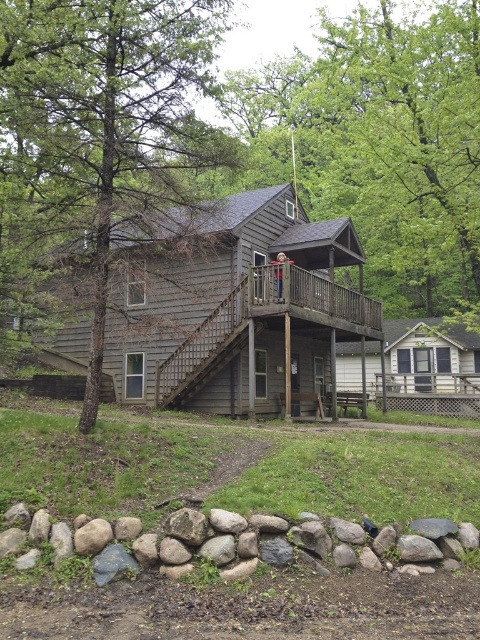
Can you confirm if brown textured tree at left is wider than gray rock wall at lower center?

No.

Is brown textured tree at left to the left of gray rock wall at lower center from the viewer's perspective?

Yes, brown textured tree at left is to the left of gray rock wall at lower center.

This screenshot has height=640, width=480. In order to click on brown textured tree at left in this screenshot , I will do `click(106, 122)`.

Is smooth rock wall at lower center taller than wooden porch at center?

In fact, smooth rock wall at lower center may be shorter than wooden porch at center.

Does smooth rock wall at lower center have a smaller size compared to wooden porch at center?

Yes, smooth rock wall at lower center is smaller than wooden porch at center.

Is point (455, 516) less distant than point (418, 385)?

That is True.

Identify the location of smooth rock wall at lower center. (229, 467).

Does wooden stairs at center have a lesser width compared to wooden porch at center?

No.

Does wooden stairs at center have a smaller size compared to wooden porch at center?

No.

I want to click on wooden stairs at center, so click(204, 349).